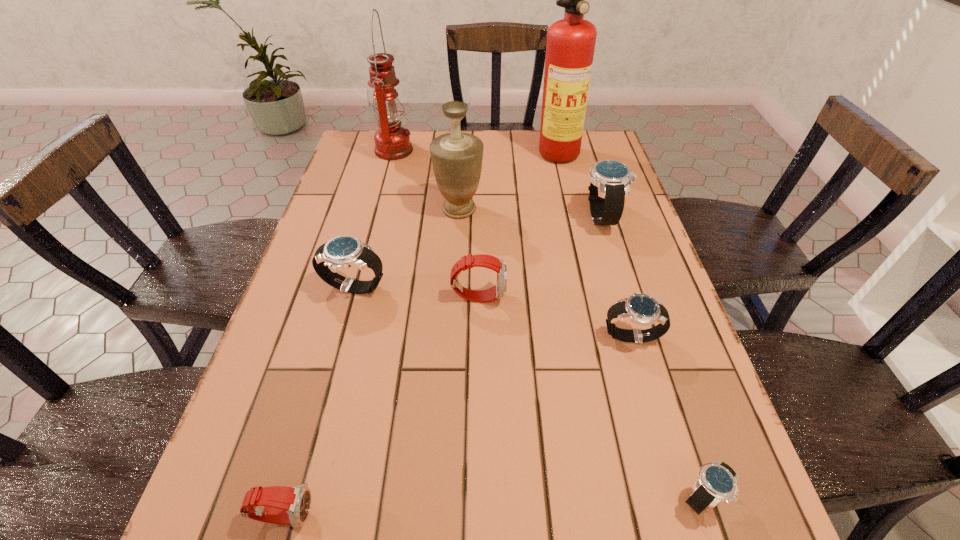
Image resolution: width=960 pixels, height=540 pixels. I want to click on the bigger red watch, so click(498, 291).

I want to click on the second nearest silver watch, so click(642, 309).

In order to click on the third nearest object in this screenshot , I will do `click(642, 309)`.

Identify the location of the left red watch. (284, 505).

Where is `the nearer red watch`? This screenshot has width=960, height=540. the nearer red watch is located at coordinates (284, 505).

This screenshot has height=540, width=960. Identify the location of the shortest object. (717, 481).

At what (x,y) coordinates should I click in order to perform the action: click on the nearest silver watch. Please return your answer as a coordinate pair (x, y). The image size is (960, 540). Looking at the image, I should click on (717, 481).

Image resolution: width=960 pixels, height=540 pixels. What are the coordinates of `free point located on the front-facing side of the red fire extinguisher` in the screenshot? It's located at (590, 253).

Locate an element on the screen. This screenshot has height=540, width=960. vacant space located on the right of the oil lamp is located at coordinates (517, 151).

The image size is (960, 540). Identify the location of vacant space located 0.390m on the right of the seventh shortest object. (624, 209).